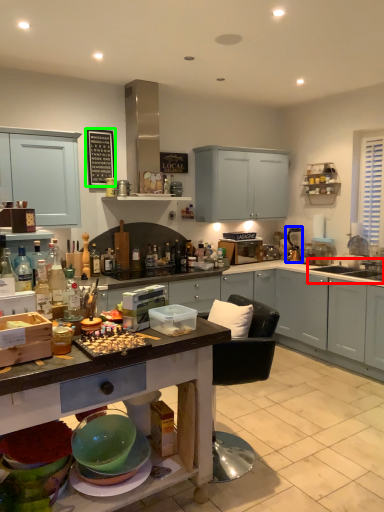
Question: Which object is positioned closest to sink (highlighted by a red box)? Select from appliance (highlighted by a blue box) and bulletin board (highlighted by a green box).

Choices:
 (A) appliance
 (B) bulletin board

Answer: (A)